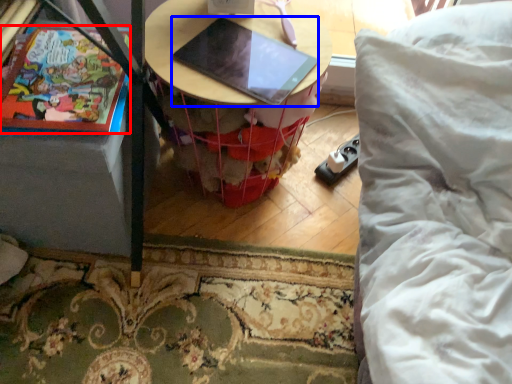
Question: Which object appears closest to the camera in this image, comic book (highlighted by a red box) or laptop (highlighted by a blue box)?

Choices:
 (A) comic book
 (B) laptop

Answer: (A)